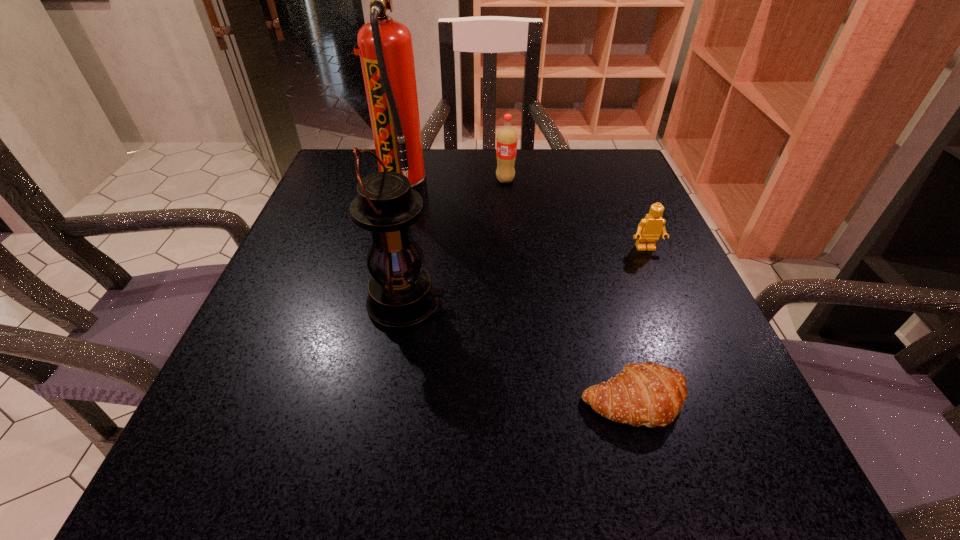
Find the location of a particular element. Image resolution: width=960 pixels, height=540 pixels. unoccupied position between the third object from right to left and the lantern is located at coordinates (456, 242).

Identify the location of vacant space that's between the Lego and the nearest object. (640, 325).

Locate an element on the screen. vacant area between the third nearest object and the fourth farthest object is located at coordinates (526, 276).

The image size is (960, 540). Find the location of `vacant point located between the lantern and the shortest object`. vacant point located between the lantern and the shortest object is located at coordinates (520, 353).

Where is `vacant space that is in between the fourth tallest object and the tallest object`? Image resolution: width=960 pixels, height=540 pixels. vacant space that is in between the fourth tallest object and the tallest object is located at coordinates (524, 220).

The height and width of the screenshot is (540, 960). Identify the location of unoccupied area between the Lego and the shortest object. (640, 325).

Identify which object is the fourth nearest to the nearest object. Please provide its 2D coordinates. Your answer should be formatted as a tuple, i.e. [(x, y)], where the tuple contains the x and y coordinates of a point satisfying the conditions above.

[(506, 142)]

This screenshot has height=540, width=960. Identify the location of object that is the third closest to the third shortest object. (401, 296).

What are the coordinates of `free spot that satisfies the following two spatial constraints: 1. with the nozzle pointing from the back of the nearest object; 2. on the right side of the tallest object` in the screenshot? It's located at (354, 402).

Locate an element on the screen. This screenshot has height=540, width=960. vacant space that satisfies the following two spatial constraints: 1. above the crescent roll, indicating its light source; 2. on the left side of the second nearest object is located at coordinates (390, 402).